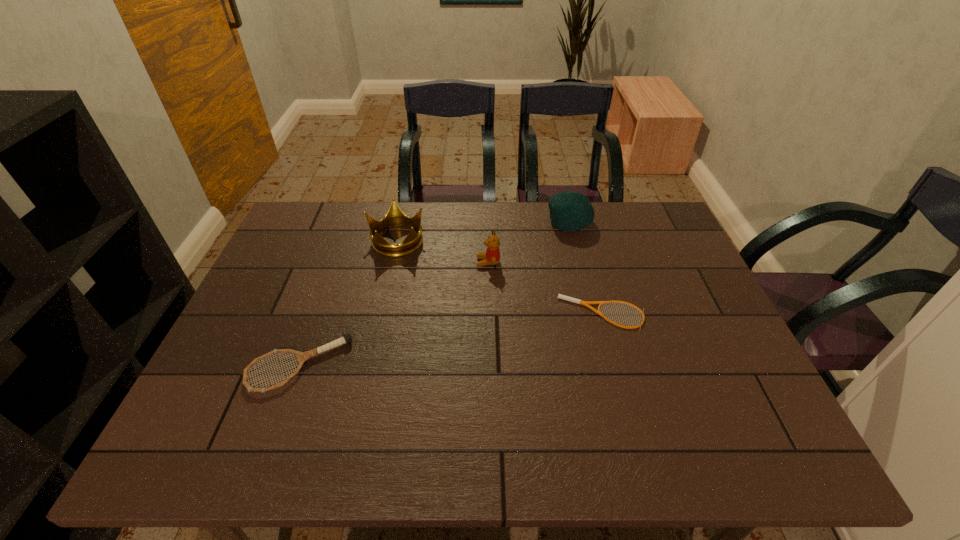
Image resolution: width=960 pixels, height=540 pixels. Find the location of `vacant area situated on the front-facing side of the teddy bear`. vacant area situated on the front-facing side of the teddy bear is located at coordinates pyautogui.click(x=433, y=262).

Locate an element on the screen. The image size is (960, 540). vacant region located 0.260m on the left of the crown is located at coordinates (286, 240).

Where is `vacant space situated 0.350m on the right of the second shortest object`? The height and width of the screenshot is (540, 960). vacant space situated 0.350m on the right of the second shortest object is located at coordinates (495, 366).

I want to click on free region located on the back of the second nearest object, so click(x=582, y=236).

The height and width of the screenshot is (540, 960). I want to click on beanie that is at the far edge, so click(x=569, y=211).

The width and height of the screenshot is (960, 540). Identify the location of crown that is at the far edge. (395, 217).

The height and width of the screenshot is (540, 960). I want to click on object that is at the left edge, so click(x=302, y=356).

Where is `vacant area at the far edge`? vacant area at the far edge is located at coordinates (597, 245).

This screenshot has height=540, width=960. In order to click on vacant space at the near edge of the desktop in this screenshot , I will do `click(536, 428)`.

You are a GUI agent. You are given a task and a screenshot of the screen. Output one action in this format:
    pyautogui.click(x=<x>, y=<y>)
    Task: Click on the blank space at the left edge
    The image size is (960, 540).
    Given the screenshot: What is the action you would take?
    pyautogui.click(x=251, y=340)